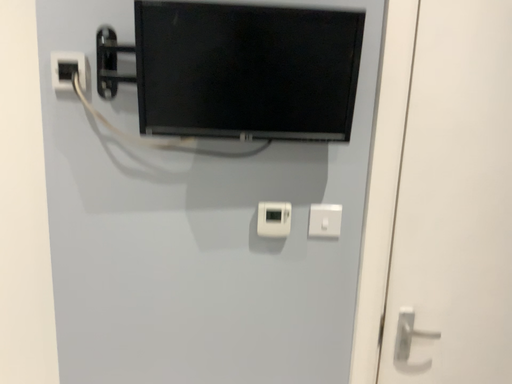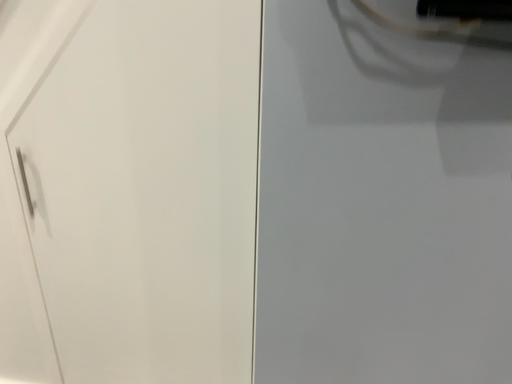
Question: Which way did the camera rotate in the video?

Choices:
 (A) rotated downward
 (B) rotated upward

Answer: (A)